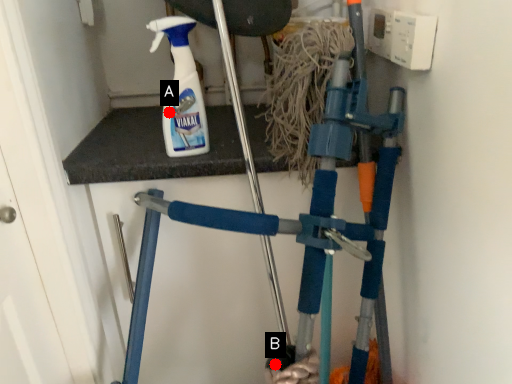
Question: Two points are circled on the image, labeled by A and B beside each circle. Among these points, which one is nearest to the camera?

Choices:
 (A) A is closer
 (B) B is closer

Answer: (B)